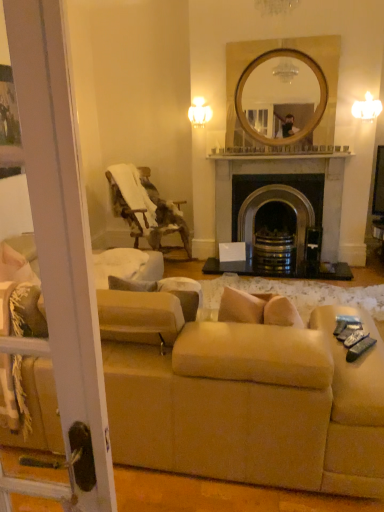
Question: From a real-world perspective, is beige fabric couch at lower center located higher than black stone fireplace at center?

Choices:
 (A) yes
 (B) no

Answer: (B)

Question: Does beige fabric couch at lower center have a greater height compared to black stone fireplace at center?

Choices:
 (A) yes
 (B) no

Answer: (B)

Question: Does beige fabric couch at lower center lie behind black stone fireplace at center?

Choices:
 (A) yes
 (B) no

Answer: (B)

Question: Does beige fabric couch at lower center have a lesser width compared to black stone fireplace at center?

Choices:
 (A) no
 (B) yes

Answer: (A)

Question: Is beige fabric couch at lower center positioned before black stone fireplace at center?

Choices:
 (A) no
 (B) yes

Answer: (B)

Question: Is there a large distance between beige fabric couch at lower center and black stone fireplace at center?

Choices:
 (A) no
 (B) yes

Answer: (B)

Question: Considering the relative sizes of black stone fireplace at center and wooden textured chair at left in the image provided, is black stone fireplace at center taller than wooden textured chair at left?

Choices:
 (A) yes
 (B) no

Answer: (A)

Question: Can you confirm if black stone fireplace at center is positioned to the left of wooden textured chair at left?

Choices:
 (A) no
 (B) yes

Answer: (A)

Question: Is black stone fireplace at center to the right of wooden textured chair at left from the viewer's perspective?

Choices:
 (A) no
 (B) yes

Answer: (B)

Question: Can we say black stone fireplace at center lies outside wooden textured chair at left?

Choices:
 (A) yes
 (B) no

Answer: (A)

Question: Is black stone fireplace at center directly adjacent to wooden textured chair at left?

Choices:
 (A) no
 (B) yes

Answer: (A)

Question: Considering the relative sizes of black stone fireplace at center and wooden textured chair at left in the image provided, is black stone fireplace at center wider than wooden textured chair at left?

Choices:
 (A) yes
 (B) no

Answer: (B)

Question: Is wooden textured chair at left far away from black stone fireplace at center?

Choices:
 (A) yes
 (B) no

Answer: (B)